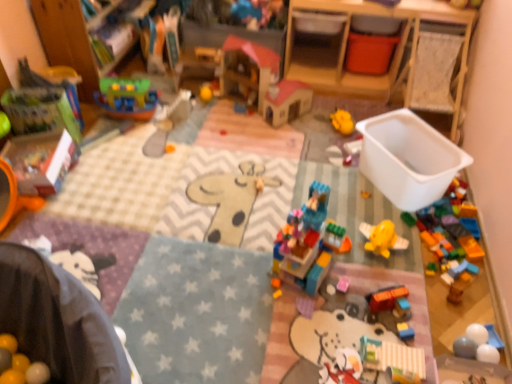
Where is `vacant area that lies in front of translucent plastic airplane at center, placed as the fourth toy when sorted from bottom to top`? This screenshot has height=384, width=512. vacant area that lies in front of translucent plastic airplane at center, placed as the fourth toy when sorted from bottom to top is located at coordinates (371, 216).